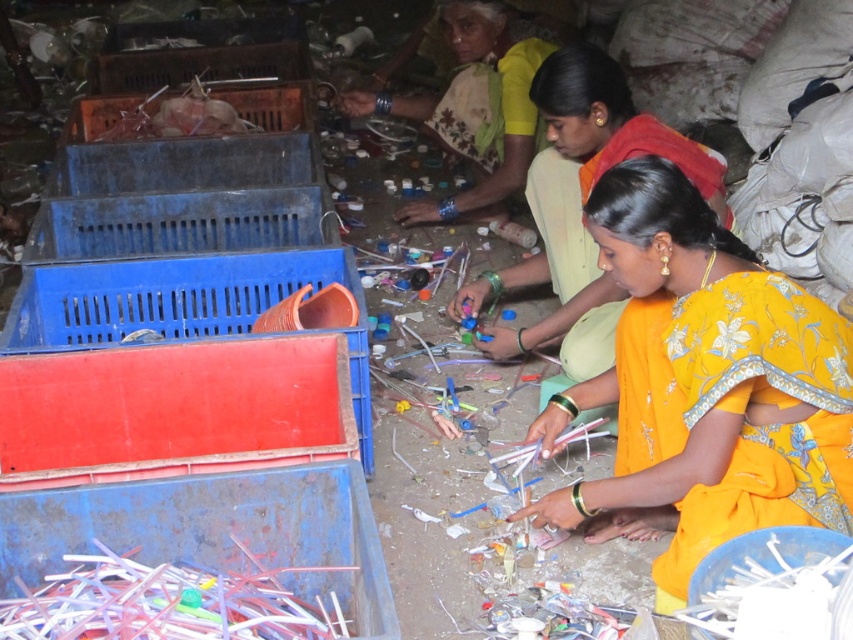
Which of these two, yellow embroidered saree at center or red plastic crate at lower left, stands shorter?

Standing shorter between the two is red plastic crate at lower left.

Which is more to the left, yellow embroidered saree at center or red plastic crate at lower left?

red plastic crate at lower left is more to the left.

This screenshot has height=640, width=853. What do you see at coordinates (581, 205) in the screenshot?
I see `yellow embroidered saree at center` at bounding box center [581, 205].

Where is `yellow embroidered saree at center`? The image size is (853, 640). yellow embroidered saree at center is located at coordinates (581, 205).

Between point (595, 372) and point (451, 116), which one is positioned behind?

Point (451, 116)

At what (x,y) coordinates should I click in order to perform the action: click on yellow embroidered saree at center. Please return your answer as a coordinate pair (x, y). This screenshot has height=640, width=853. Looking at the image, I should click on (581, 205).

At what (x,y) coordinates should I click in order to perform the action: click on yellow embroidered sari at center. Please return your answer as a coordinate pair (x, y). Image resolution: width=853 pixels, height=640 pixels. Looking at the image, I should click on (704, 385).

Between point (728, 401) and point (277, 291), which one is positioned behind?

The point (277, 291) is behind.

Where is `yellow embroidered sari at center`? yellow embroidered sari at center is located at coordinates (704, 385).

The image size is (853, 640). In order to click on yellow embroidered sari at center in this screenshot , I will do `click(704, 385)`.